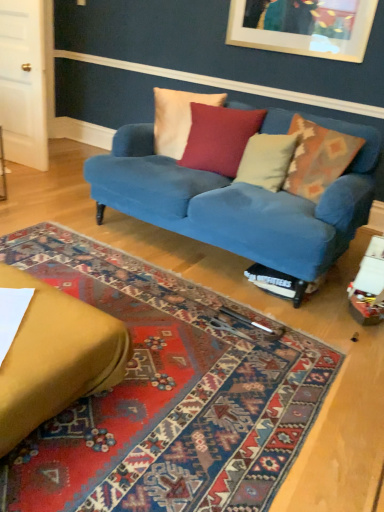
What are the coordinates of `vacant space behind velvet yellow studio couch at lower left, which ranks as the second studio couch in back-to-front order` in the screenshot? It's located at (114, 288).